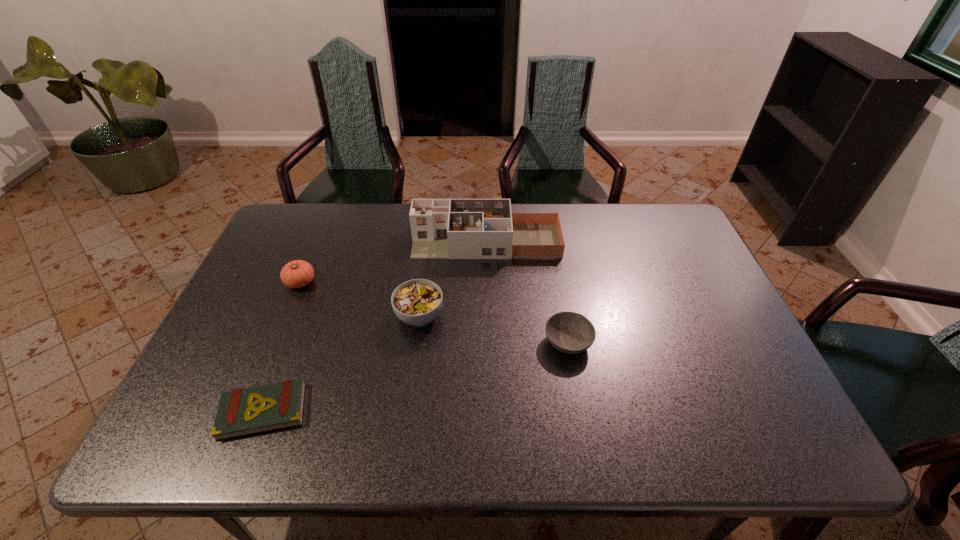
At what (x,y) coordinates should I click in order to perform the action: click on dollhouse. Please return your answer as a coordinate pair (x, y). Image resolution: width=960 pixels, height=540 pixels. Looking at the image, I should click on (441, 228).

Where is `the farthest object`? The width and height of the screenshot is (960, 540). the farthest object is located at coordinates (441, 228).

Where is `soup bowl`? The image size is (960, 540). soup bowl is located at coordinates point(417,302).

You are a GUI agent. You are given a task and a screenshot of the screen. Output one action in this format:
    pyautogui.click(x=<x>, y=<y>)
    Task: Click on the tomato
    
    Given the screenshot: What is the action you would take?
    pyautogui.click(x=298, y=273)

Locate an element on the screen. This screenshot has height=540, width=960. the fourth tallest object is located at coordinates (569, 332).

Where is `book`? The width and height of the screenshot is (960, 540). book is located at coordinates (241, 412).

Image resolution: width=960 pixels, height=540 pixels. I want to click on the nearest object, so click(241, 412).

Identify the location of free location located at the front door of the tallest object. (320, 241).

You are a GUI agent. You are given a task and a screenshot of the screen. Output one action in this format:
    pyautogui.click(x=<x>, y=<y>)
    Task: Click on the free space located 0.260m at the front door of the tallest object
    This screenshot has width=960, height=540.
    Given the screenshot: What is the action you would take?
    pyautogui.click(x=332, y=241)

The image size is (960, 540). What are the coordinates of `free location located at the front door of the tallest object` in the screenshot? It's located at (388, 241).